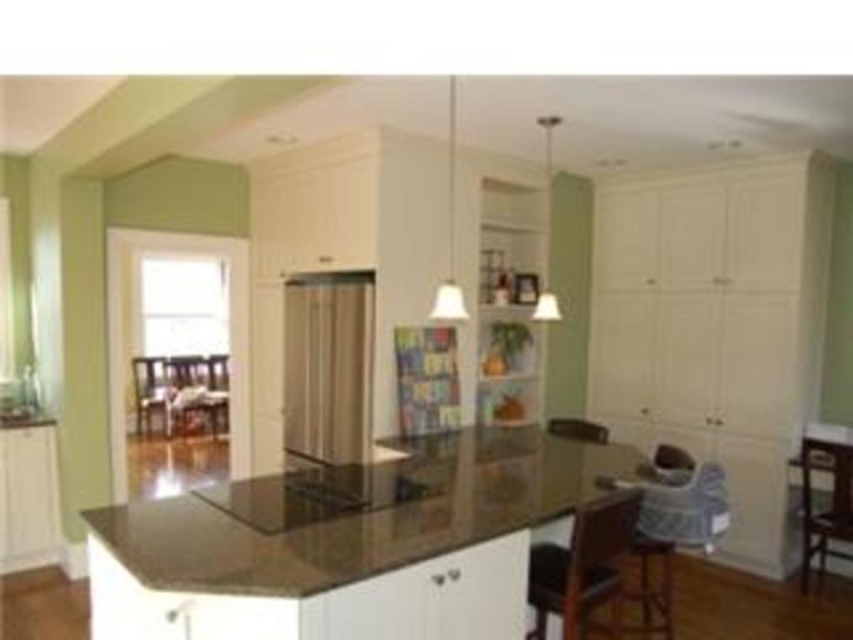
You are standing in the modern kitchen and want to place a new plant pot that is 0.3 meters wide on the island. The island has a dark brown granite countertop. Can you place the plant pot at the position where the matte black chair at left is currently located?

The matte black chair at left is located at position point (148, 388). Since the plant pot is 0.3 meters wide, you need to check if there is enough space on the island. However, the exact dimensions of the island and the available space at that position are not provided in the scene description. Therefore, it is uncertain whether the plant pot can be placed there without further information.

You are standing in the kitchen and want to take a photo of the matte black chair at left. If your camera has a maximum focus range of 30 feet, will it be able to capture the chair clearly?

The matte black chair at left and camera are 29.64 feet apart from each other, so the camera can focus on the matte black chair at left since it is within the 30 feet range.